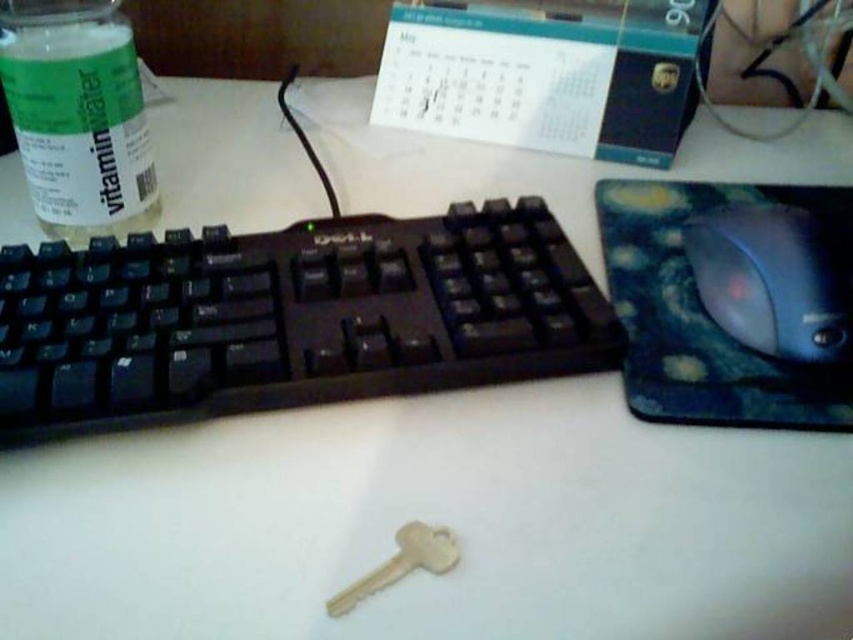
Question: Does white paper calendar at upper center appear on the left side of gold metallic key at center?

Choices:
 (A) yes
 (B) no

Answer: (B)

Question: Estimate the real-world distances between objects in this image. Which object is closer to the gold metallic key at center?

Choices:
 (A) blue plastic mouse at right
 (B) black plastic keyboard at center
 (C) white paper calendar at upper center
 (D) green plastic bottle at upper left

Answer: (B)

Question: Which of the following is the closest to the observer?

Choices:
 (A) gold metallic key at center
 (B) green plastic bottle at upper left

Answer: (A)

Question: Which of the following is the closest to the observer?

Choices:
 (A) (695, 244)
 (B) (403, 541)
 (C) (242, 344)
 (D) (141, 104)

Answer: (B)

Question: Where is black plastic keyboard at center located in relation to gold metallic key at center in the image?

Choices:
 (A) above
 (B) below

Answer: (A)

Question: Is black plastic keyboard at center to the left of white paper calendar at upper center from the viewer's perspective?

Choices:
 (A) no
 (B) yes

Answer: (B)